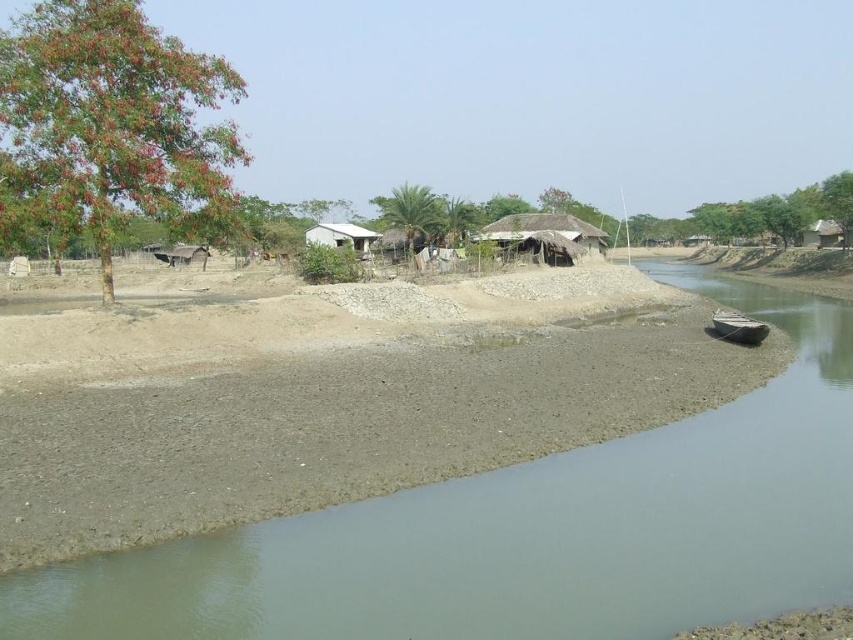
Question: Estimate the real-world distances between objects in this image. Which object is closer to the green leafy palm tree at center?

Choices:
 (A) brown dirt river at lower left
 (B) green leafy tree at upper left

Answer: (B)

Question: Is thatched straw hut at center below brown thatched hut at right?

Choices:
 (A) no
 (B) yes

Answer: (A)

Question: Does thatched straw hut at center lie behind white matte house at center?

Choices:
 (A) no
 (B) yes

Answer: (B)

Question: Among these objects, which one is nearest to the camera?

Choices:
 (A) thatched straw hut at center
 (B) green leafy tree at upper left

Answer: (B)

Question: Which of the following is the farthest from the observer?

Choices:
 (A) (566, 212)
 (B) (743, 336)
 (C) (393, 250)
 (D) (566, 563)

Answer: (A)

Question: Does green leafy palm tree at center appear over white matte house at center?

Choices:
 (A) yes
 (B) no

Answer: (A)